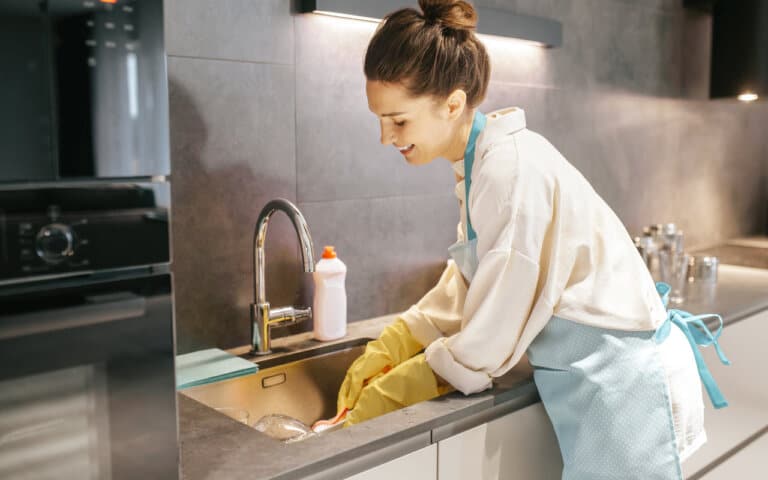
Where is `sink`? sink is located at coordinates (302, 398).